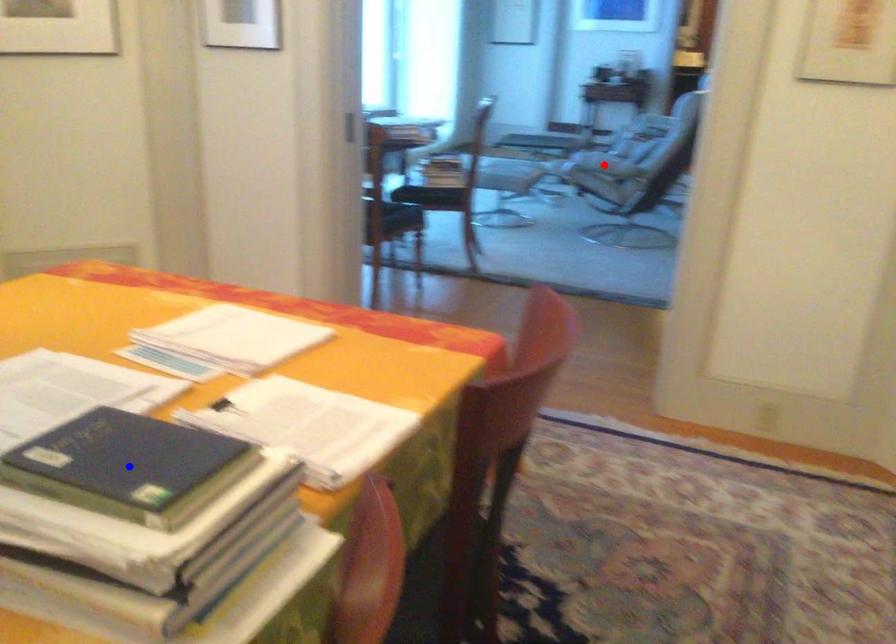
Question: In the image, two points are highlighted. Which point is nearer to the camera? Reply with the corresponding letter.

Choices:
 (A) blue point
 (B) red point

Answer: (A)